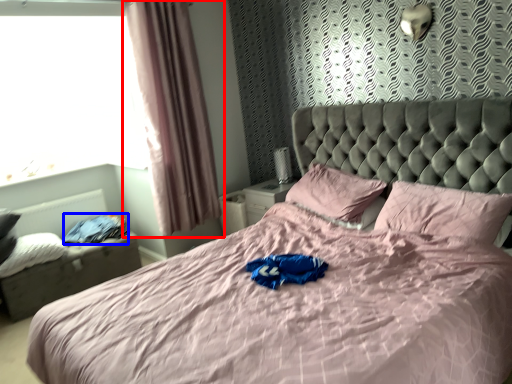
Question: Which point is closer to the camera, curtain (highlighted by a red box) or clothing (highlighted by a blue box)?

Choices:
 (A) curtain
 (B) clothing

Answer: (A)